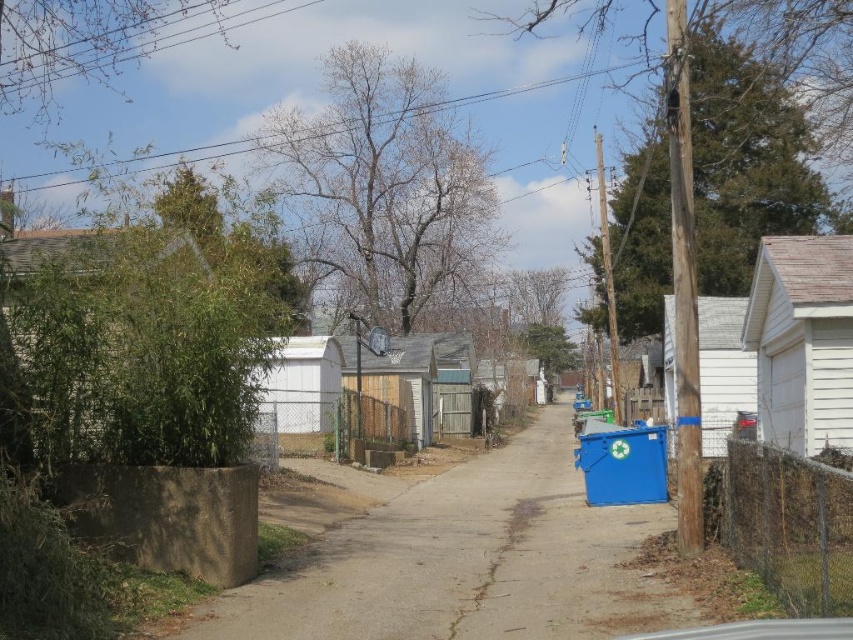
Question: Does blue plastic bin at right have a smaller size compared to wire mesh fence at lower right?

Choices:
 (A) no
 (B) yes

Answer: (A)

Question: From the image, what is the correct spatial relationship of blue plastic bin at right in relation to green chain-link fence at center?

Choices:
 (A) right
 (B) left

Answer: (A)

Question: Which point is farther to the camera?

Choices:
 (A) (337, 444)
 (B) (456, 483)

Answer: (A)

Question: Which object is the farthest from the green chain-link fence at center?

Choices:
 (A) blue plastic bin at right
 (B) wire mesh fence at lower right

Answer: (B)

Question: In this image, where is wire mesh fence at lower right located relative to green chain-link fence at center?

Choices:
 (A) right
 (B) left

Answer: (A)

Question: Which point is closer to the camera taking this photo?

Choices:
 (A) (306, 444)
 (B) (846, 518)

Answer: (B)